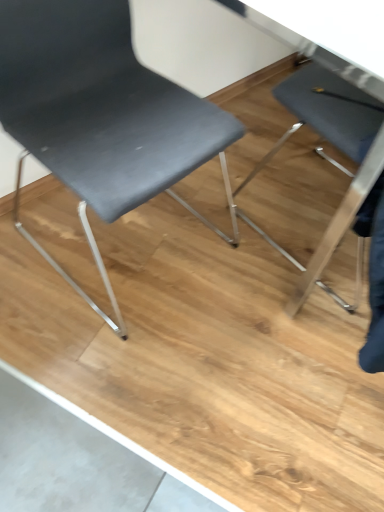
Find the location of a particular element. vacant space underneath matte black chair at left, the second chair when ordered from right to left (from a real-world perspective) is located at coordinates (126, 248).